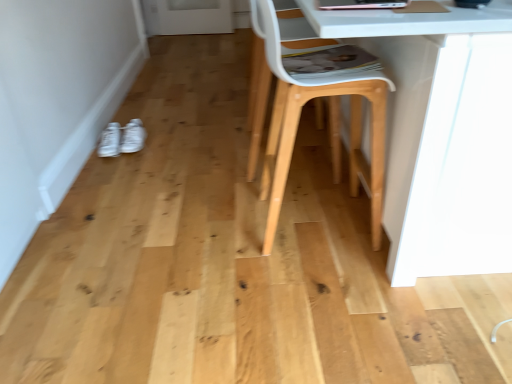
What do you see at coordinates (133, 137) in the screenshot?
I see `white matte sneakers at lower left, the 1th footwear from the right` at bounding box center [133, 137].

Where is `white fabric sneakers at lower left, which appears as the second footwear when viewed from the right`? This screenshot has width=512, height=384. white fabric sneakers at lower left, which appears as the second footwear when viewed from the right is located at coordinates (110, 141).

This screenshot has width=512, height=384. What do you see at coordinates (257, 89) in the screenshot? I see `white plastic swivel chair at center` at bounding box center [257, 89].

Find the location of a particular element. white matte sneakers at lower left, the 1th footwear from the right is located at coordinates (133, 137).

Looking at their sizes, would you say white matte sneakers at lower left, the 1th footwear from the right, is wider or thinner than natural wood chair at center?

Clearly, white matte sneakers at lower left, the 1th footwear from the right, has less width compared to natural wood chair at center.

In the image, is white matte sneakers at lower left, the 1th footwear from the right, positioned in front of or behind natural wood chair at center?

In the image, white matte sneakers at lower left, the 1th footwear from the right, appears behind natural wood chair at center.

From the picture: Is white matte sneakers at lower left, the 1th footwear from the right, facing away from natural wood chair at center?

No, white matte sneakers at lower left, the 1th footwear from the right, is not facing away from natural wood chair at center.

At what (x,y) coordinates should I click in order to perform the action: click on chair in front of the white matte sneakers at lower left, positioned as the second footwear in left-to-right order. Please return your answer as a coordinate pair (x, y). The height and width of the screenshot is (384, 512). Looking at the image, I should click on (317, 97).

From a real-world perspective, is white fabric sneakers at lower left, arranged as the 1th footwear when viewed from the left, physically located above or below white plastic swivel chair at center?

white fabric sneakers at lower left, arranged as the 1th footwear when viewed from the left, is situated lower than white plastic swivel chair at center in the real world.

Is white fabric sneakers at lower left, arranged as the 1th footwear when viewed from the left, positioned beyond the bounds of white plastic swivel chair at center?

Indeed, white fabric sneakers at lower left, arranged as the 1th footwear when viewed from the left, is completely outside white plastic swivel chair at center.

Does white fabric sneakers at lower left, which appears as the second footwear when viewed from the right, have a lesser height compared to white plastic swivel chair at center?

Indeed, white fabric sneakers at lower left, which appears as the second footwear when viewed from the right, has a lesser height compared to white plastic swivel chair at center.

Which is more to the right, white plastic swivel chair at center or white matte sneakers at lower left, the 1th footwear from the right?

From the viewer's perspective, white plastic swivel chair at center appears more on the right side.

Is white plastic swivel chair at center taller or shorter than white matte sneakers at lower left, the 1th footwear from the right?

Considering their sizes, white plastic swivel chair at center has more height than white matte sneakers at lower left, the 1th footwear from the right.

The height and width of the screenshot is (384, 512). There is a white plastic swivel chair at center. Find the location of `the 1st footwear below it (from a real-world perspective)`. the 1st footwear below it (from a real-world perspective) is located at coordinates (133, 137).

Is point (275, 177) closer or farther from the camera than point (137, 125)?

Point (275, 177).

From a real-world perspective, who is located lower, natural wood chair at center or white matte sneakers at lower left, positioned as the second footwear in left-to-right order?

white matte sneakers at lower left, positioned as the second footwear in left-to-right order, from a real-world perspective.

Based on the photo, can you confirm if natural wood chair at center is bigger than white matte sneakers at lower left, the 1th footwear from the right?

Correct, natural wood chair at center is larger in size than white matte sneakers at lower left, the 1th footwear from the right.

Measure the distance from natural wood chair at center to white matte sneakers at lower left, the 1th footwear from the right.

3.78 feet.

Considering the sizes of natural wood chair at center and white plastic swivel chair at center in the image, is natural wood chair at center bigger or smaller than white plastic swivel chair at center?

natural wood chair at center is bigger than white plastic swivel chair at center.

From the image's perspective, relative to white plastic swivel chair at center, is natural wood chair at center above or below?

Clearly, from the image's perspective, natural wood chair at center is below white plastic swivel chair at center.

Is white plastic swivel chair at center surrounded by natural wood chair at center?

No, natural wood chair at center does not contain white plastic swivel chair at center.

Who is taller, natural wood chair at center or white plastic swivel chair at center?

natural wood chair at center.

Considering the relative positions of white matte sneakers at lower left, positioned as the second footwear in left-to-right order, and white fabric sneakers at lower left, which appears as the second footwear when viewed from the right, in the image provided, is white matte sneakers at lower left, positioned as the second footwear in left-to-right order, to the left of white fabric sneakers at lower left, which appears as the second footwear when viewed from the right, from the viewer's perspective?

No.

Is white matte sneakers at lower left, positioned as the second footwear in left-to-right order, facing away from white fabric sneakers at lower left, arranged as the 1th footwear when viewed from the left?

No, white matte sneakers at lower left, positioned as the second footwear in left-to-right order, is not facing away from white fabric sneakers at lower left, arranged as the 1th footwear when viewed from the left.

The image size is (512, 384). Find the location of `footwear on the left of white matte sneakers at lower left, the 1th footwear from the right`. footwear on the left of white matte sneakers at lower left, the 1th footwear from the right is located at coordinates (110, 141).

Is white matte sneakers at lower left, the 1th footwear from the right, wider than white fabric sneakers at lower left, arranged as the 1th footwear when viewed from the left?

In fact, white matte sneakers at lower left, the 1th footwear from the right, might be narrower than white fabric sneakers at lower left, arranged as the 1th footwear when viewed from the left.

Is white fabric sneakers at lower left, arranged as the 1th footwear when viewed from the left, not within white matte sneakers at lower left, the 1th footwear from the right?

Yes, white fabric sneakers at lower left, arranged as the 1th footwear when viewed from the left, is located beyond the bounds of white matte sneakers at lower left, the 1th footwear from the right.

From a real-world perspective, is white fabric sneakers at lower left, arranged as the 1th footwear when viewed from the left, located higher than white matte sneakers at lower left, positioned as the second footwear in left-to-right order?

No, from a real-world perspective, white fabric sneakers at lower left, arranged as the 1th footwear when viewed from the left, is not on top of white matte sneakers at lower left, positioned as the second footwear in left-to-right order.

From the picture: Between white fabric sneakers at lower left, which appears as the second footwear when viewed from the right, and white matte sneakers at lower left, positioned as the second footwear in left-to-right order, which one has less height?

Standing shorter between the two is white matte sneakers at lower left, positioned as the second footwear in left-to-right order.

Is white fabric sneakers at lower left, arranged as the 1th footwear when viewed from the left, bigger than white matte sneakers at lower left, the 1th footwear from the right?

Yes, white fabric sneakers at lower left, arranged as the 1th footwear when viewed from the left, is bigger than white matte sneakers at lower left, the 1th footwear from the right.

Where is `the 1st footwear directly beneath the natural wood chair at center (from a real-world perspective)`? the 1st footwear directly beneath the natural wood chair at center (from a real-world perspective) is located at coordinates (133, 137).

Locate an element on the screen. This screenshot has width=512, height=384. swivel chair lying above the white fabric sneakers at lower left, arranged as the 1th footwear when viewed from the left (from the image's perspective) is located at coordinates pyautogui.click(x=257, y=89).

Considering their positions, is white plastic swivel chair at center positioned further to white fabric sneakers at lower left, which appears as the second footwear when viewed from the right, than white matte sneakers at lower left, positioned as the second footwear in left-to-right order?

white plastic swivel chair at center.

From the image, which object appears to be farther from white plastic swivel chair at center, white matte sneakers at lower left, the 1th footwear from the right, or white fabric sneakers at lower left, which appears as the second footwear when viewed from the right?

white fabric sneakers at lower left, which appears as the second footwear when viewed from the right, is further to white plastic swivel chair at center.

Based on their spatial positions, is white plastic swivel chair at center or white matte sneakers at lower left, positioned as the second footwear in left-to-right order, closer to natural wood chair at center?

white plastic swivel chair at center lies closer to natural wood chair at center than the other object.

Looking at the image, which one is located further to white matte sneakers at lower left, the 1th footwear from the right, white fabric sneakers at lower left, arranged as the 1th footwear when viewed from the left, or white plastic swivel chair at center?

white plastic swivel chair at center.

Estimate the real-world distances between objects in this image. Which object is further from natural wood chair at center, white fabric sneakers at lower left, arranged as the 1th footwear when viewed from the left, or white plastic swivel chair at center?

Based on the image, white fabric sneakers at lower left, arranged as the 1th footwear when viewed from the left, appears to be further to natural wood chair at center.

When comparing their distances from natural wood chair at center, does white matte sneakers at lower left, the 1th footwear from the right, or white plastic swivel chair at center seem closer?

white plastic swivel chair at center lies closer to natural wood chair at center than the other object.

Looking at this image, when comparing their distances from white matte sneakers at lower left, the 1th footwear from the right, does natural wood chair at center or white fabric sneakers at lower left, which appears as the second footwear when viewed from the right, seem further?

natural wood chair at center is positioned further to the anchor white matte sneakers at lower left, the 1th footwear from the right.

Estimate the real-world distances between objects in this image. Which object is further from white fabric sneakers at lower left, which appears as the second footwear when viewed from the right, white matte sneakers at lower left, the 1th footwear from the right, or natural wood chair at center?

The object further to white fabric sneakers at lower left, which appears as the second footwear when viewed from the right, is natural wood chair at center.

Where is `swivel chair situated between white fabric sneakers at lower left, which appears as the second footwear when viewed from the right, and natural wood chair at center from left to right`? The width and height of the screenshot is (512, 384). swivel chair situated between white fabric sneakers at lower left, which appears as the second footwear when viewed from the right, and natural wood chair at center from left to right is located at coordinates (257, 89).

Locate an element on the screen. The width and height of the screenshot is (512, 384). footwear located between natural wood chair at center and white matte sneakers at lower left, the 1th footwear from the right, in the depth direction is located at coordinates (110, 141).

The image size is (512, 384). Identify the location of swivel chair located between natural wood chair at center and white matte sneakers at lower left, the 1th footwear from the right, in the depth direction. (257, 89).

You are a GUI agent. You are given a task and a screenshot of the screen. Output one action in this format:
    pyautogui.click(x=<x>, y=<y>)
    Task: Click on the footwear between white fabric sneakers at lower left, arranged as the 1th footwear when viewed from the left, and white plastic swivel chair at center
    Image resolution: width=512 pixels, height=384 pixels.
    Given the screenshot: What is the action you would take?
    pyautogui.click(x=133, y=137)